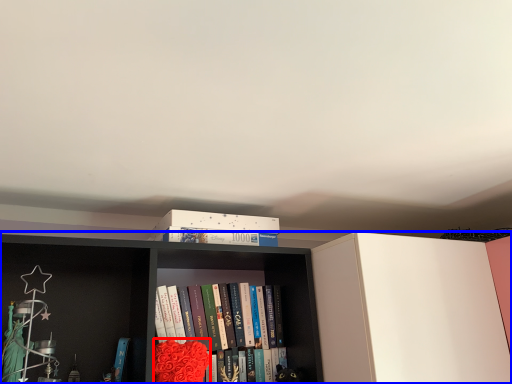
Question: Which point is further to the camera, flower (highlighted by a red box) or bookcase (highlighted by a blue box)?

Choices:
 (A) flower
 (B) bookcase

Answer: (A)